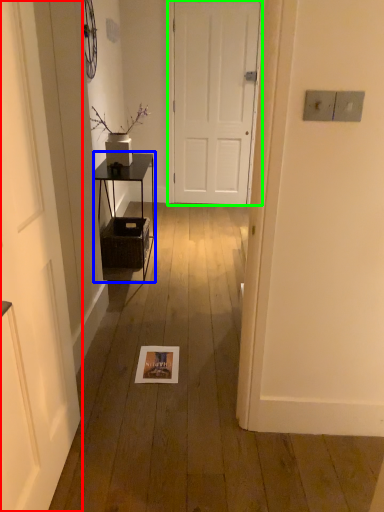
Question: Based on their relative distances, which object is nearer to door (highlighted by a red box)? Choose from table (highlighted by a blue box) and door (highlighted by a green box).

Choices:
 (A) table
 (B) door

Answer: (A)